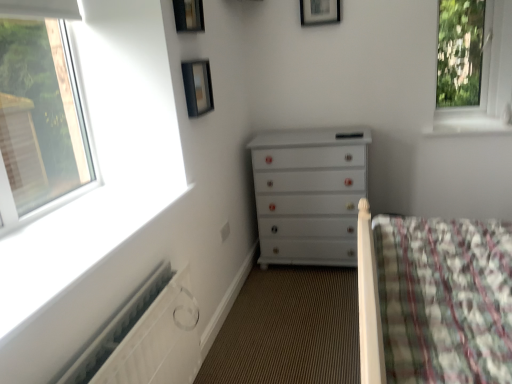
Question: Is point (194, 26) positioned closer to the camera than point (158, 296)?

Choices:
 (A) closer
 (B) farther

Answer: (B)

Question: Considering the positions of black glass picture frame at upper center, which ranks as the 1th picture frame in front-to-back order, and white textured radiator at lower left in the image, is black glass picture frame at upper center, which ranks as the 1th picture frame in front-to-back order, wider or thinner than white textured radiator at lower left?

Choices:
 (A) thin
 (B) wide

Answer: (A)

Question: Based on their relative distances, which object is nearer to the transparent glass window at upper right?

Choices:
 (A) white glossy chest of drawers at center
 (B) black glass picture frame at upper center, positioned as the second picture frame in bottom-to-top order
 (C) white textured radiator at lower left
 (D) white glossy window sill at upper right
 (E) matte black picture frame at upper center, the 2th picture frame in the left-to-right sequence

Answer: (D)

Question: Estimate the real-world distances between objects in this image. Which object is closer to the white textured radiator at lower left?

Choices:
 (A) wooden picture frame at upper center, which is counted as the 1th picture frame, starting from the back
 (B) matte black picture frame at upper center, the first picture frame when ordered from bottom to top
 (C) transparent glass window at upper right
 (D) white glossy window sill at upper right
 (E) white glossy chest of drawers at center

Answer: (B)